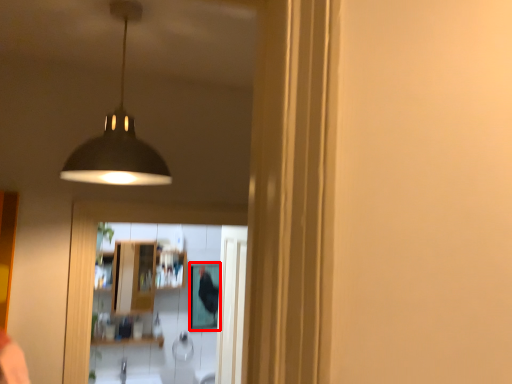
Question: From the image's perspective, considering the relative positions of mirror (annotated by the red box) and lamp in the image provided, where is mirror (annotated by the red box) located with respect to the staircase?

Choices:
 (A) above
 (B) below

Answer: (B)